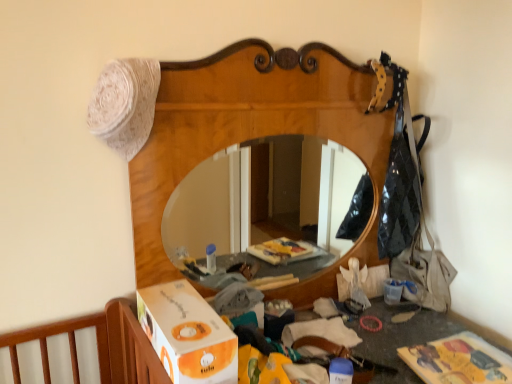
Where is `wooden bunk bed at lower left`? This screenshot has height=384, width=512. wooden bunk bed at lower left is located at coordinates (255, 136).

The image size is (512, 384). Describe the element at coordinates (255, 136) in the screenshot. I see `wooden bunk bed at lower left` at that location.

Locate an element on the screen. The image size is (512, 384). wooden bunk bed at lower left is located at coordinates (255, 136).